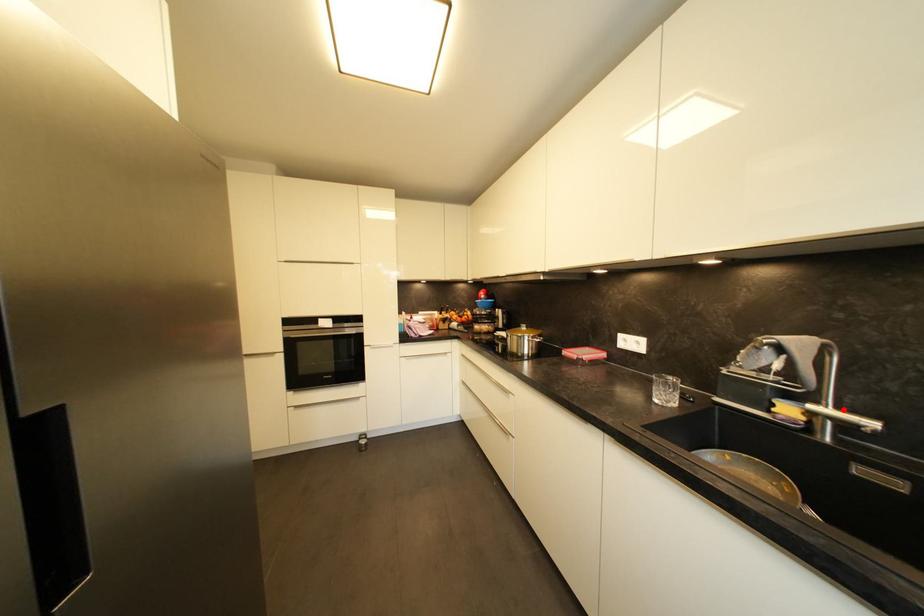
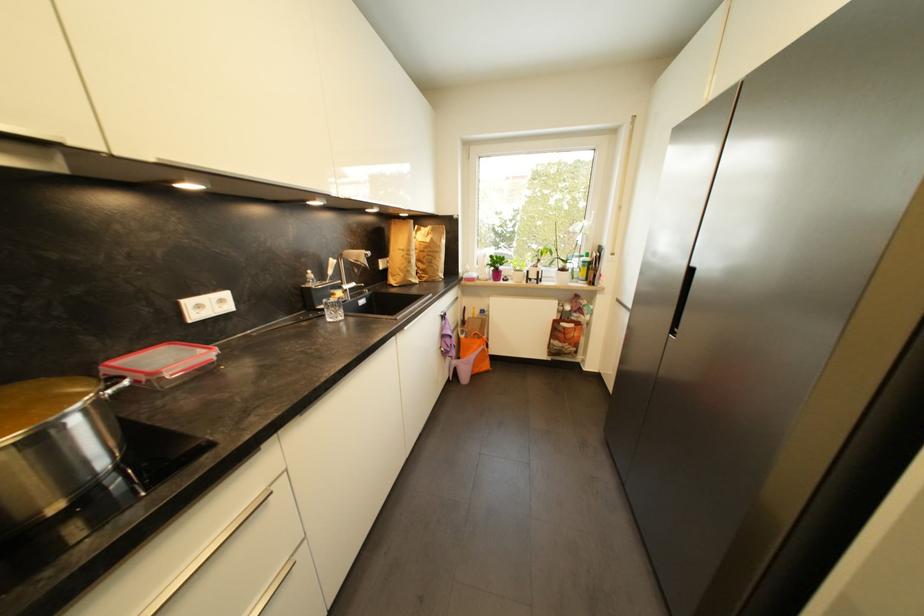
Question: I am providing you with two images of the same scene from different viewpoints. In image1, a red point is highlighted. Considering the same 3D point in image2, which of the following is correct?

Choices:
 (A) It is closer
 (B) It is farther

Answer: (A)